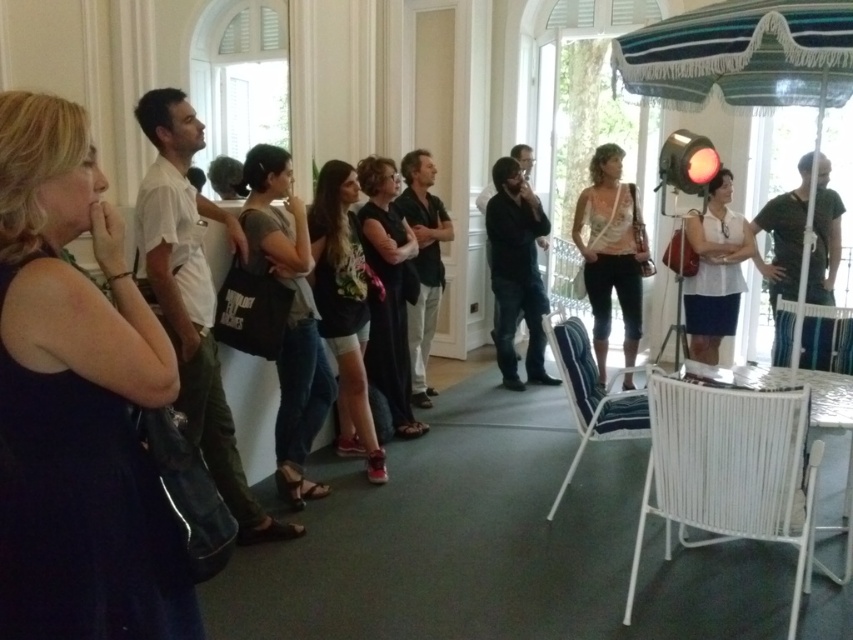
Question: Which point is farther to the camera?

Choices:
 (A) (714, 304)
 (B) (633, 323)

Answer: (B)

Question: Is light beige fabric purse at center thinner than white fabric dress at center?

Choices:
 (A) no
 (B) yes

Answer: (A)

Question: Among these objects, which one is nearest to the camera?

Choices:
 (A) light beige fabric purse at center
 (B) white fabric dress at center

Answer: (A)

Question: Does light beige fabric purse at center appear on the right side of white fabric dress at center?

Choices:
 (A) yes
 (B) no

Answer: (B)

Question: Which point is closer to the camera?

Choices:
 (A) light beige fabric purse at center
 (B) white fabric dress at center

Answer: (A)

Question: Is light beige fabric purse at center to the right of white fabric dress at center from the viewer's perspective?

Choices:
 (A) no
 (B) yes

Answer: (A)